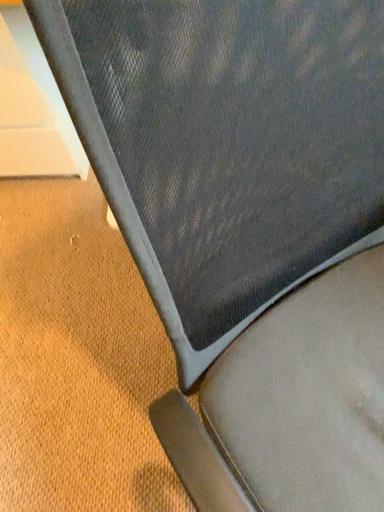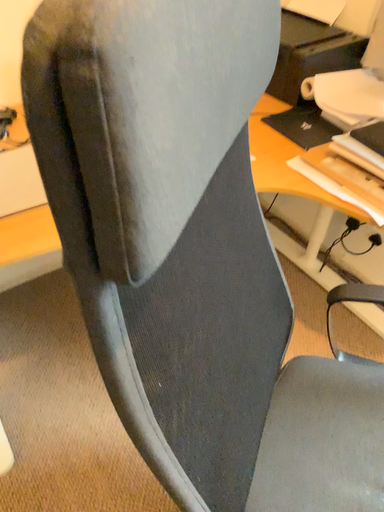
Question: Which way did the camera rotate in the video?

Choices:
 (A) rotated left
 (B) rotated right

Answer: (B)